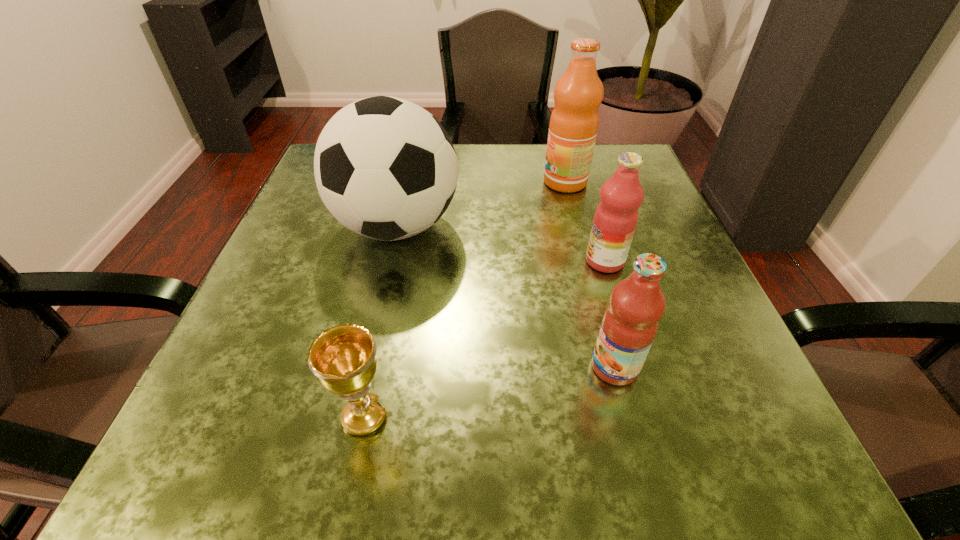
Where is `the farthest fruit juice`? This screenshot has height=540, width=960. the farthest fruit juice is located at coordinates (574, 121).

Locate an element on the screen. This screenshot has height=540, width=960. the second tallest object is located at coordinates (385, 168).

At what (x,y) coordinates should I click in order to perform the action: click on the second nearest fruit juice. Please return your answer as a coordinate pair (x, y). The height and width of the screenshot is (540, 960). Looking at the image, I should click on (616, 216).

Where is `the nearest fruit juice`? This screenshot has width=960, height=540. the nearest fruit juice is located at coordinates click(630, 323).

I want to click on chalice, so click(x=343, y=357).

At what (x,y) coordinates should I click in order to perform the action: click on the shortest object. Please return your answer as a coordinate pair (x, y). The width and height of the screenshot is (960, 540). Looking at the image, I should click on (343, 357).

Find the location of a particular element. vacant space located 0.220m on the label side of the tallest fruit juice is located at coordinates (445, 182).

You are a GUI agent. You are given a task and a screenshot of the screen. Output one action in this format:
    pyautogui.click(x=<x>, y=<y>)
    Task: Click on the vacant space located on the label side of the tallest fruit juice
    The width and height of the screenshot is (960, 540).
    Given the screenshot: What is the action you would take?
    pyautogui.click(x=396, y=182)

I want to click on vacant point located 0.400m on the label side of the tallest fruit juice, so click(366, 182).

Identify the location of free location located 0.270m on the right of the soccer ball. The image size is (960, 540). (596, 226).